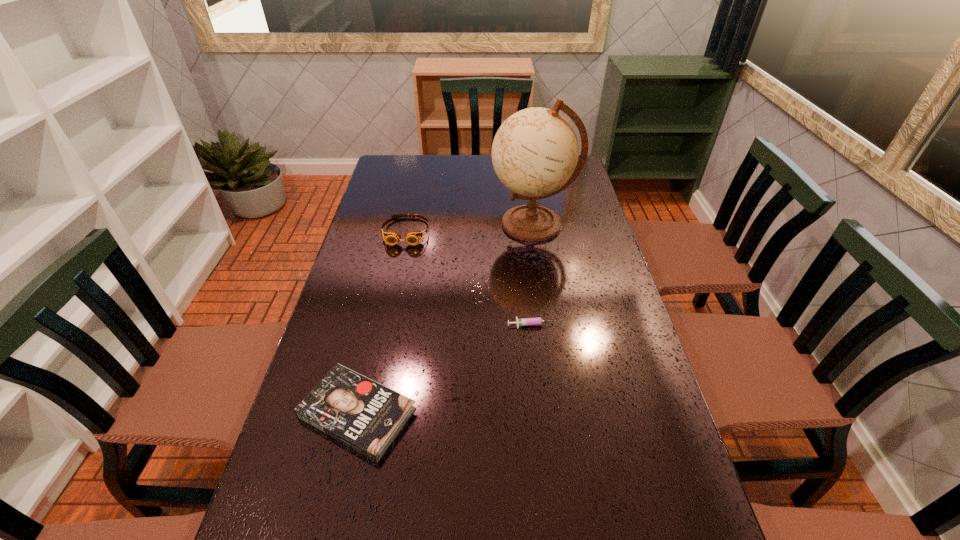
The width and height of the screenshot is (960, 540). In order to click on globe in this screenshot , I will do `click(535, 151)`.

The width and height of the screenshot is (960, 540). I want to click on goggles, so click(x=392, y=238).

Locate an element on the screen. the third tallest object is located at coordinates (361, 413).

Locate an element on the screen. This screenshot has width=960, height=540. book is located at coordinates (361, 413).

The height and width of the screenshot is (540, 960). Identify the location of the third farthest object. (538, 320).

You are a GUI agent. You are given a task and a screenshot of the screen. Output one action in this format:
    pyautogui.click(x=<x>, y=<y>)
    Task: Click on the shortest object
    
    Given the screenshot: What is the action you would take?
    pyautogui.click(x=538, y=320)

Locate an element on the screen. This screenshot has height=540, width=960. free space located on the surface of the tallest object is located at coordinates tap(412, 224).

Image resolution: width=960 pixels, height=540 pixels. Find the location of `vacant space located 0.280m on the surface of the tallest object`. vacant space located 0.280m on the surface of the tallest object is located at coordinates (406, 224).

What are the coordinates of `free space located on the surface of the tallest object` in the screenshot? It's located at (454, 224).

At what (x,y) coordinates should I click in order to perform the action: click on vacant space positioned with the lenses facing forward on the goggles. Please return your answer as a coordinate pair (x, y). Looking at the image, I should click on (382, 345).